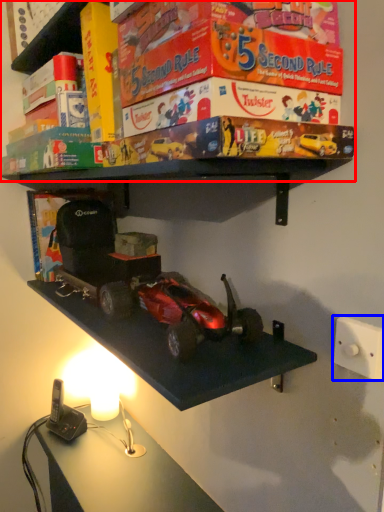
Question: Which object is closer to the camera taking this photo, shelf (highlighted by a red box) or light switch (highlighted by a blue box)?

Choices:
 (A) shelf
 (B) light switch

Answer: (A)